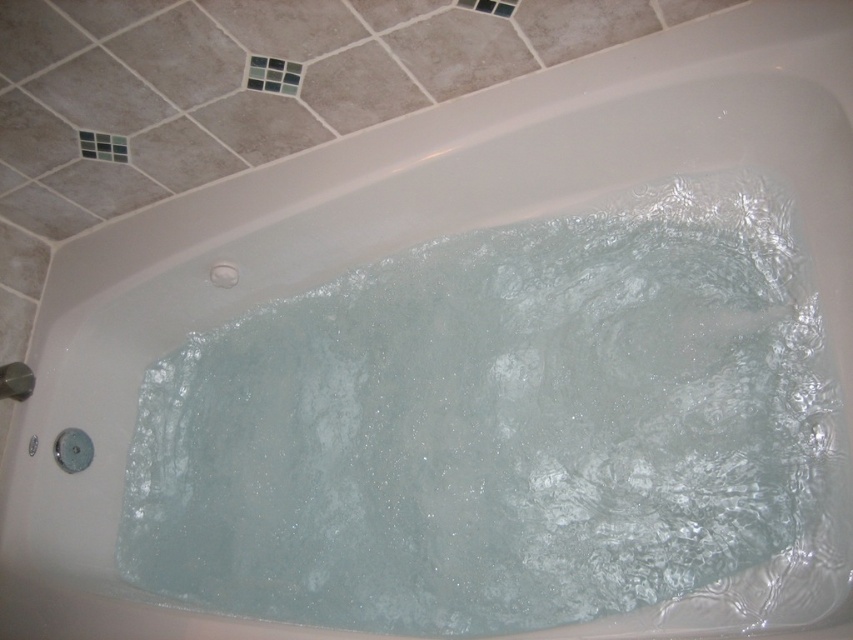
You are designing a bathroom layout and need to ensure that the clear glass tile at upper center and the brushed metal shower at lower left will fit within a 1.2 meter wide space. Based on their widths, can both items fit side by side?

The clear glass tile at upper center might be wider than the brushed metal shower at lower left, so their combined widths could exceed 1.2 meters. It is uncertain if they will fit without more precise measurements.

You are a bathroom designer planning to install a new light fixture. You want to place it exactly where the clear glass tile at upper center is located, which is marked by point (273, 76). Can you confirm the coordinates of this point?

The clear glass tile at upper center is located at point (273, 76).

In the scene shown: You are a bathroom designer planning to install a new light fixture. You want to place it directly above the clear glass tile at upper center. What are the coordinates where you should position the light fixture?

The coordinates for the clear glass tile at upper center are 0.119 in the x direction and 0.321 in the y direction. Therefore, the light fixture should be placed at point (273,76) to be directly above it.